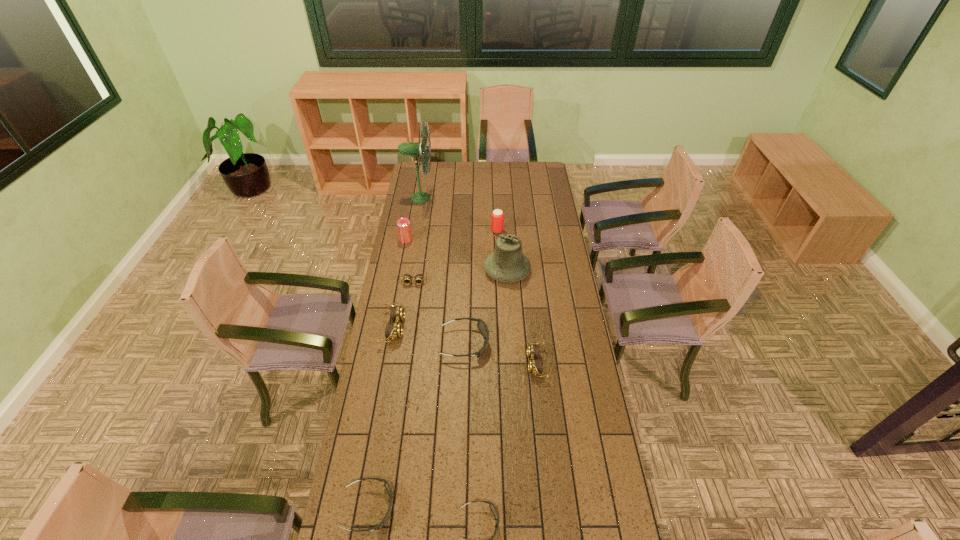
Locate an element on the screen. Image resolution: width=960 pixels, height=540 pixels. the rightmost brown goggles is located at coordinates click(534, 366).

In order to click on the rightmost goggles in this screenshot , I will do `click(534, 366)`.

The width and height of the screenshot is (960, 540). I want to click on the second biggest black goggles, so click(386, 484).

Identify the location of the farthest goggles. (419, 278).

You are a GUI agent. You are given a task and a screenshot of the screen. Output one action in this format:
    pyautogui.click(x=<x>, y=<y>)
    Task: Click on the smallest brown goggles
    The image size is (960, 540).
    Given the screenshot: What is the action you would take?
    pyautogui.click(x=419, y=278)

Find the location of a particular element. The image size is (960, 540). blank space located on the front-facing side of the fan is located at coordinates (456, 198).

Find the location of a particular element. Image resolution: width=960 pixels, height=540 pixels. free space located 0.360m on the left of the bell is located at coordinates (412, 270).

The height and width of the screenshot is (540, 960). In order to click on vacant space situated on the right of the right beer can in this screenshot , I will do `click(553, 231)`.

At what (x,y) coordinates should I click in order to perform the action: click on free space located 0.160m on the back of the nearer beer can. Please return your answer as a coordinate pair (x, y). Looking at the image, I should click on (410, 218).

You are a GUI agent. You are given a task and a screenshot of the screen. Output one action in this format:
    pyautogui.click(x=<x>, y=<y>)
    Task: Click on the free point located 0.360m through the lenses of the sixth shortest object
    The width and height of the screenshot is (960, 540).
    Given the screenshot: What is the action you would take?
    click(x=487, y=328)